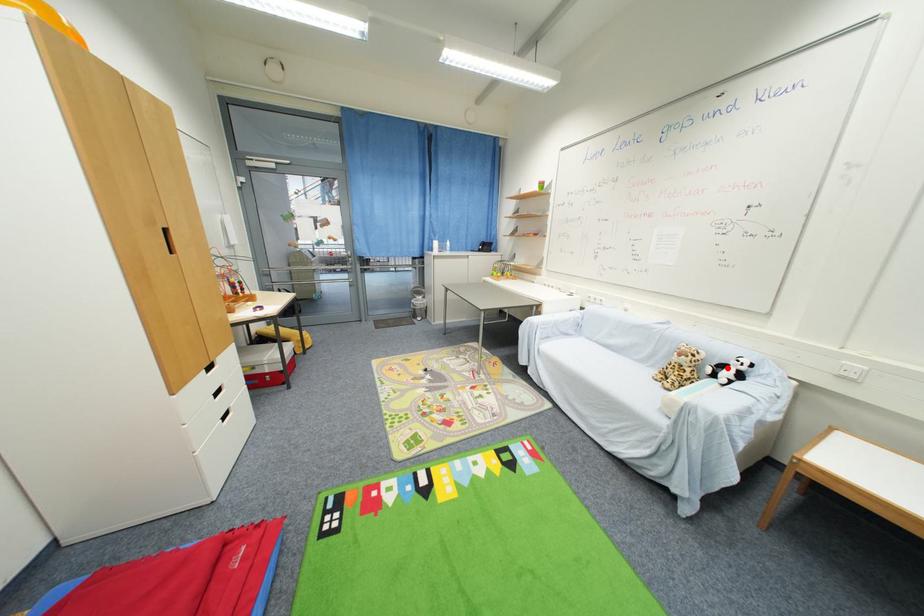
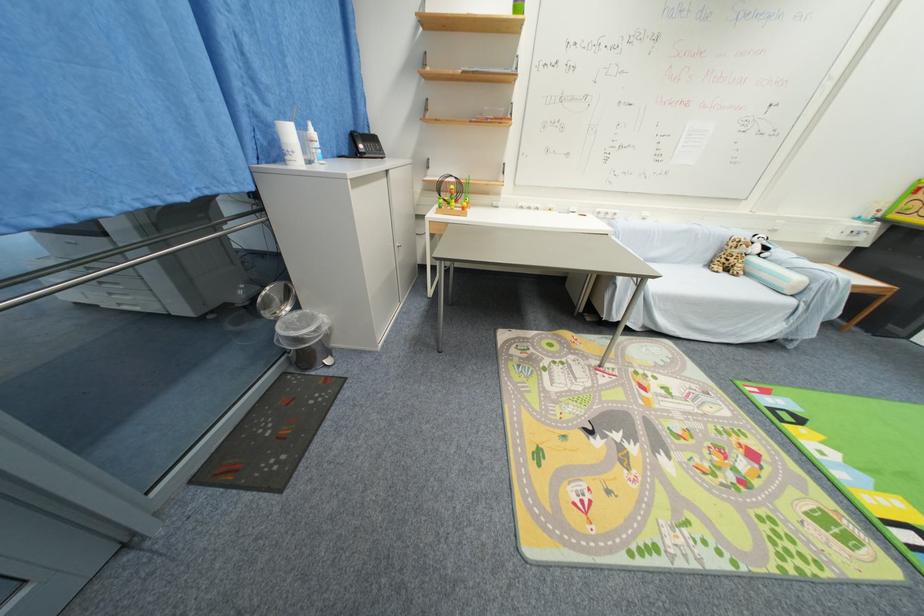
In the second image, find the point that corresponds to the highlighted location in the first image.

(754, 246)